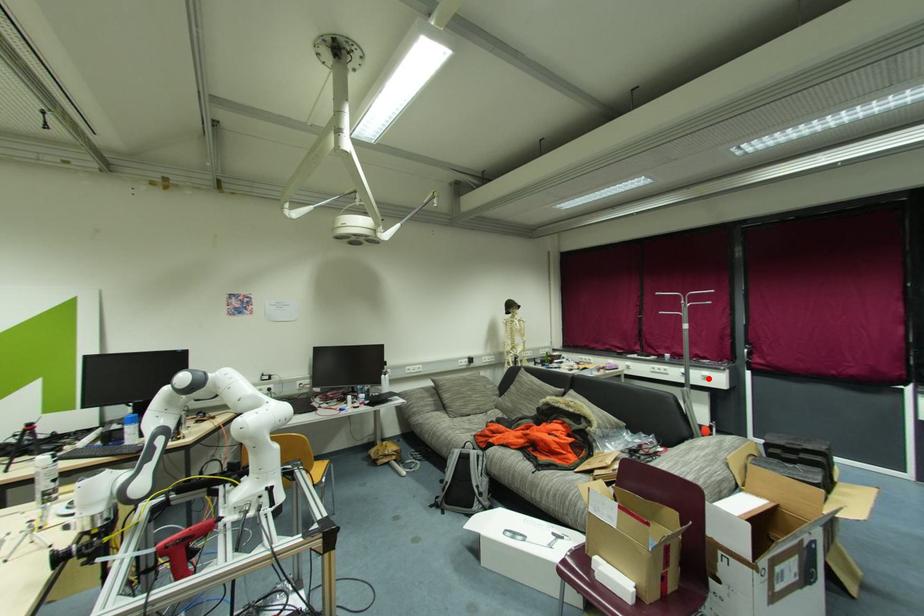
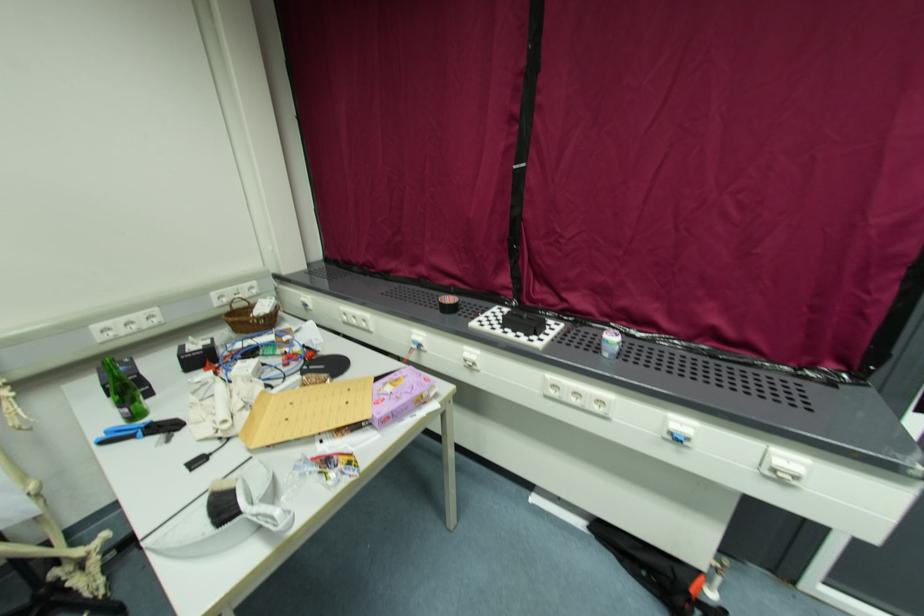
Question: I am providing you with two images of the same scene from different viewpoints. In image1, a red point is highlighted. Considering the same 3D point in image2, which of the following is correct?

Choices:
 (A) It is closer
 (B) It is farther

Answer: (A)